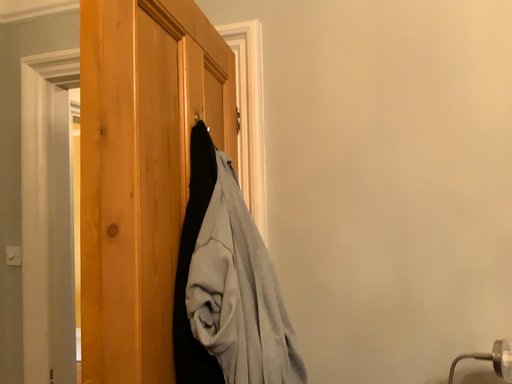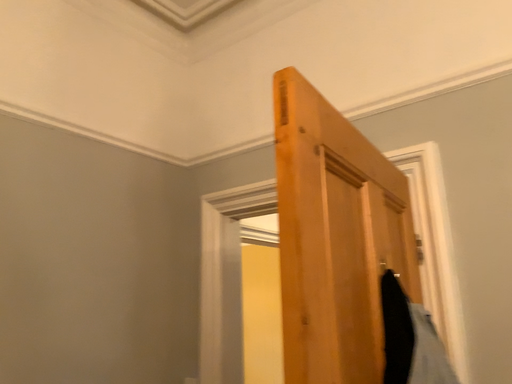
Question: Which way did the camera rotate in the video?

Choices:
 (A) rotated right
 (B) rotated left

Answer: (B)